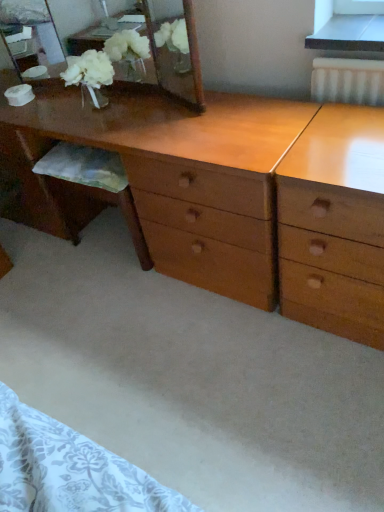
The width and height of the screenshot is (384, 512). I want to click on free region under wooden mirror at upper left (from a real-world perspective), so click(121, 94).